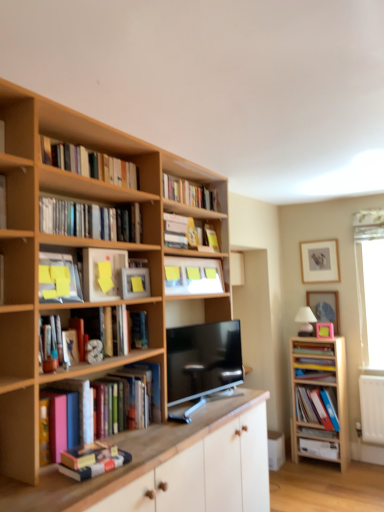
Question: In terms of width, does black glossy tv at center look wider or thinner when compared to matte plastic book at left, the 6th book in the top-to-bottom sequence?

Choices:
 (A) wide
 (B) thin

Answer: (A)

Question: Does point (183, 350) appear closer or farther from the camera than point (52, 260)?

Choices:
 (A) farther
 (B) closer

Answer: (A)

Question: Which object is the closest to the hardcover book at upper center, marked as the 10th book in a bottom-to-top arrangement?

Choices:
 (A) matte silver picture frame at upper right, the third picture frame from the bottom
 (B) pink matte picture frame at upper center, acting as the 3th picture frame starting from the top
 (C) wooden book at right, the fourth book ordered from the bottom
 (D) matte blue book at right, positioned as the first book in bottom-to-top order
 (E) matte yellow paper at center-left

Answer: (E)

Question: Based on their relative distances, which object is nearer to the wooden book at right, the eighth book when ordered from top to bottom?

Choices:
 (A) hardcover book at right, which appears as the 9th book when viewed from the top
 (B) matte wooden book at left, marked as the 9th book in a bottom-to-top arrangement
 (C) hardcover books at upper left, which is the eighth book from bottom to top
 (D) wooden cabinet at right, which is counted as the second cabinetry, starting from the front
 (E) matte silver picture frame at upper right, placed as the 1th picture frame when sorted from top to bottom

Answer: (A)